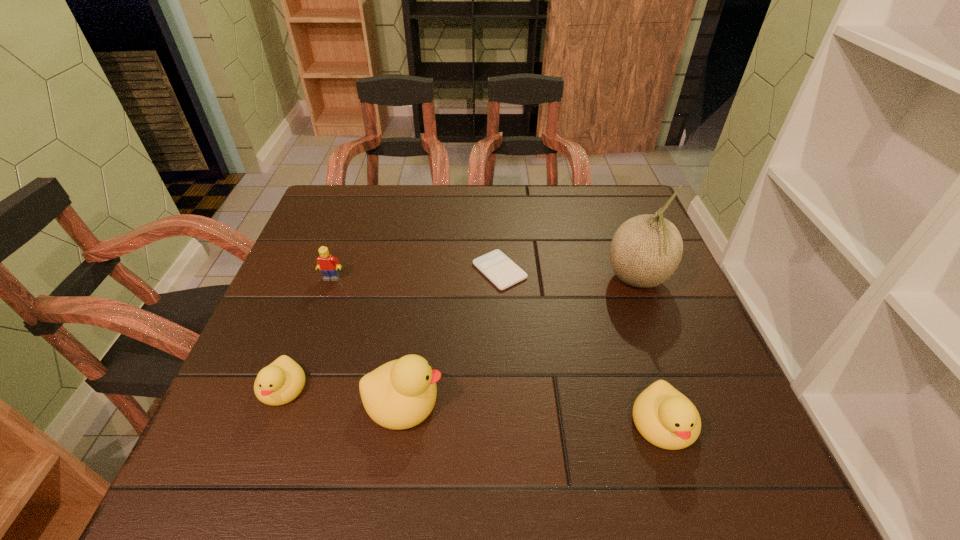
This screenshot has width=960, height=540. In order to click on the leftmost duckling in this screenshot , I will do `click(280, 382)`.

The width and height of the screenshot is (960, 540). I want to click on the second shortest object, so click(280, 382).

Locate an element on the screen. the fourth object from right to left is located at coordinates (400, 394).

At what (x,y) coordinates should I click in order to perform the action: click on the second duckling from right to left. Please return your answer as a coordinate pair (x, y). This screenshot has height=540, width=960. Looking at the image, I should click on (400, 394).

Where is `the rightmost duckling`? The image size is (960, 540). the rightmost duckling is located at coordinates (666, 418).

Where is `Lego`? This screenshot has height=540, width=960. Lego is located at coordinates click(329, 265).

Locate an element on the screen. calculator is located at coordinates (496, 266).

The width and height of the screenshot is (960, 540). In order to click on the third object from right to left in this screenshot , I will do `click(496, 266)`.

Image resolution: width=960 pixels, height=540 pixels. In order to click on cantaloup in this screenshot , I will do `click(645, 251)`.

I want to click on free space located on the face of the second duckling from left to right, so click(502, 399).